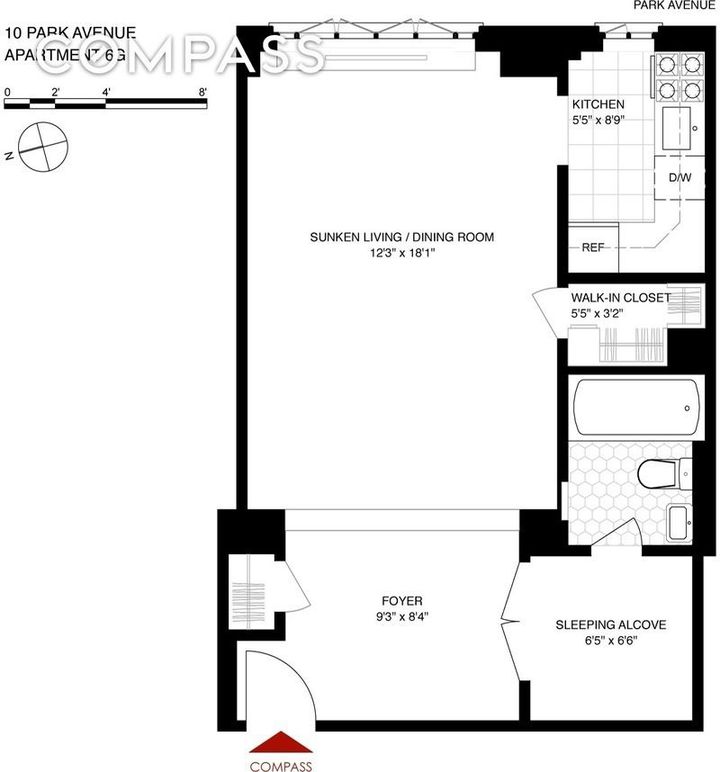
This screenshot has width=720, height=772. I want to click on "walk-in closet" written in black capital letters, so coord(600,293), coord(643,300).